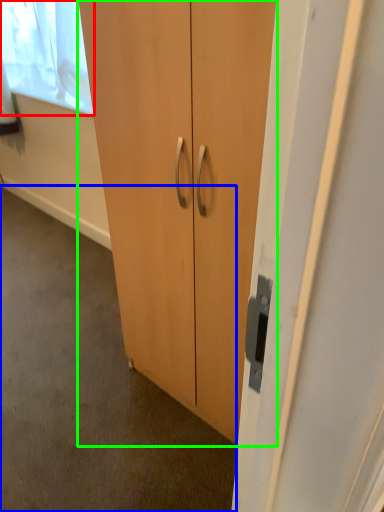
Question: Which object is positioned closest to window screen (highlighted by a red box)? Select from concrete (highlighted by a blue box) and cupboard (highlighted by a green box).

Choices:
 (A) concrete
 (B) cupboard

Answer: (A)